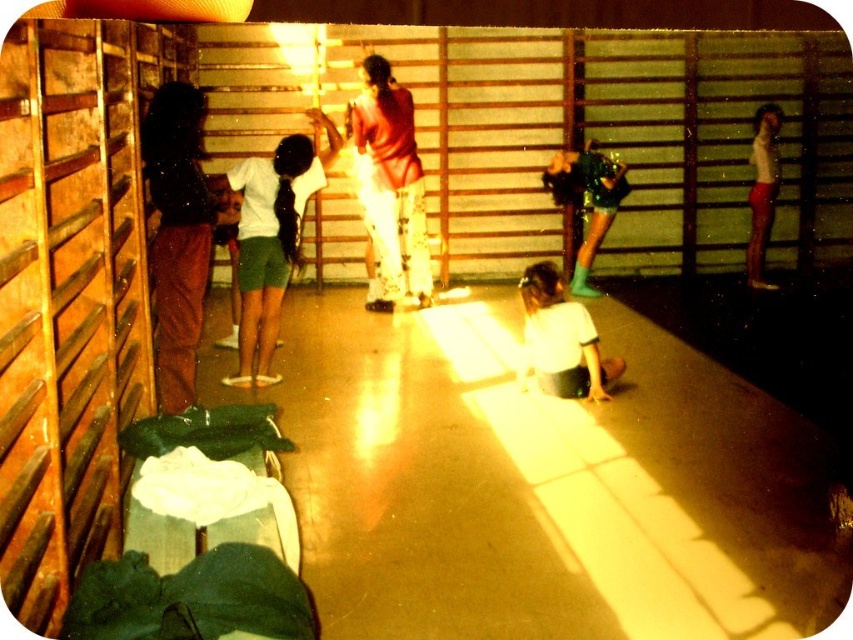
Question: Which of these objects is positioned closest to the matte brown pants at left?

Choices:
 (A) white matte shirt at lower center
 (B) shiny green boots at center
 (C) white matte shorts at center

Answer: (C)

Question: Is matte brown pants at left further to the viewer compared to shiny green boots at center?

Choices:
 (A) yes
 (B) no

Answer: (B)

Question: Which object appears closest to the camera in this image?

Choices:
 (A) shiny green boots at center
 (B) white matte shirt at lower center

Answer: (B)

Question: Is matte brown pants at left bigger than white matte shorts at center?

Choices:
 (A) yes
 (B) no

Answer: (B)

Question: Which of the following is the farthest from the observer?

Choices:
 (A) pos(576,259)
 (B) pos(187,131)
 (C) pos(529,332)

Answer: (A)

Question: Observing the image, what is the correct spatial positioning of white matte shorts at center in reference to shiny green boots at center?

Choices:
 (A) right
 (B) left

Answer: (B)